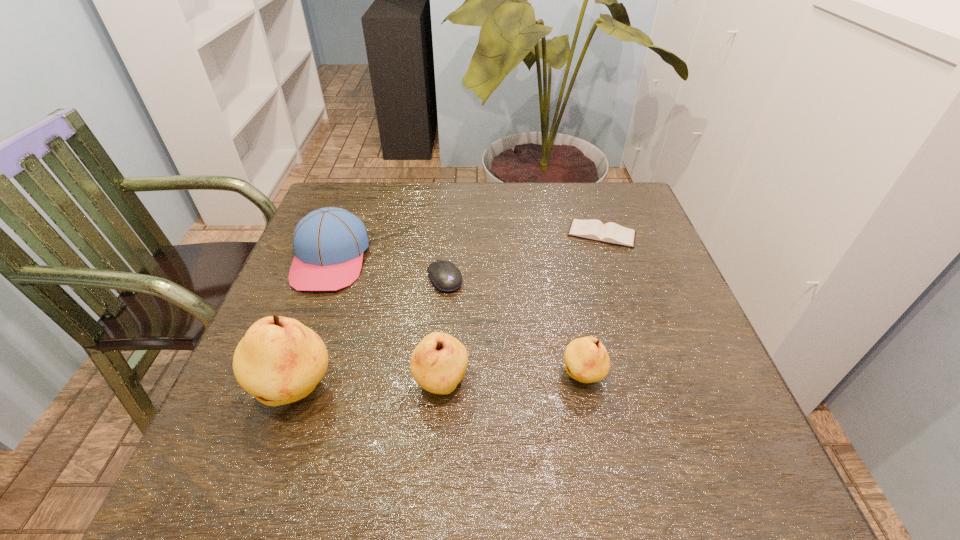
Identify the location of object that is at the near left corner. (279, 360).

This screenshot has height=540, width=960. Find the location of `object that is positioned at the far right corner`. object that is positioned at the far right corner is located at coordinates (612, 233).

In the image, there is a desktop. At what (x,y) coordinates should I click in order to perform the action: click on free space at the far edge. Please return your answer as a coordinate pair (x, y). Image resolution: width=960 pixels, height=540 pixels. Looking at the image, I should click on (575, 198).

Identify the location of vacant position at the near edge of the desktop. This screenshot has height=540, width=960. (420, 392).

Where is `vacant space at the right edge of the desktop`? This screenshot has height=540, width=960. vacant space at the right edge of the desktop is located at coordinates (631, 258).

This screenshot has width=960, height=540. Find the location of `free space at the near left corner of the desktop`. free space at the near left corner of the desktop is located at coordinates (312, 420).

Locate an element on the screen. free space at the far right corner of the desktop is located at coordinates (622, 186).

You are a GUI agent. You are given a task and a screenshot of the screen. Output one action in this format:
    pyautogui.click(x=<x>, y=<y>)
    Task: Click on the vacant area between the baseball cap and the computer mouse
    This screenshot has width=960, height=540.
    Given the screenshot: What is the action you would take?
    pyautogui.click(x=388, y=269)

Identify the location of vacant space that's between the rightmost pear and the baseball cap. (456, 318).

Locate an element on the screen. The height and width of the screenshot is (540, 960). blank region between the tallest pear and the diary is located at coordinates (449, 313).